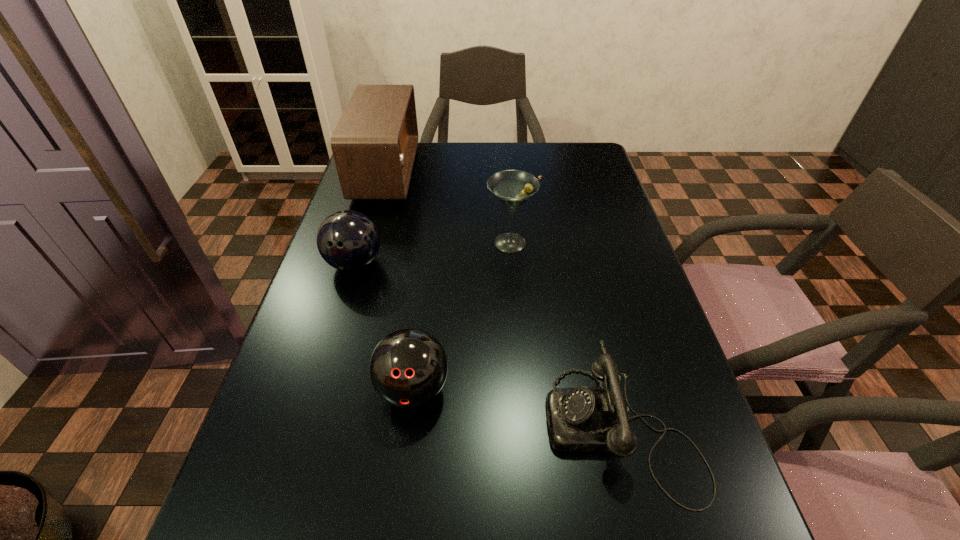
Identify the location of radio receiver. (374, 144).

At what (x,y) coordinates should I click in order to perform the action: click on martini. Please return your answer as a coordinate pair (x, y). Image resolution: width=960 pixels, height=540 pixels. Looking at the image, I should click on (513, 188).

At what (x,y) coordinates should I click in order to perform the action: click on the left bowling ball. Please return your answer as a coordinate pair (x, y). Looking at the image, I should click on (347, 240).

The width and height of the screenshot is (960, 540). Identify the location of the nearer bowling ball. (x=408, y=368).

Identify the location of the third object from right to left. (408, 368).

Image resolution: width=960 pixels, height=540 pixels. Find the location of `the shortest object`. the shortest object is located at coordinates (580, 419).

Where is `vacant region located 0.210m on the front-facing side of the radio receiver`? The image size is (960, 540). vacant region located 0.210m on the front-facing side of the radio receiver is located at coordinates (479, 172).

The width and height of the screenshot is (960, 540). I want to click on vacant space situated 0.320m on the left of the martini, so pos(364,243).

At what (x,y) coordinates should I click in order to perform the action: click on free spot located on the side of the left bowling ball with the finger holes. Please return your answer as a coordinate pair (x, y). The width and height of the screenshot is (960, 540). Looking at the image, I should click on (324, 366).

Locate an element on the screen. This screenshot has width=960, height=540. vacant space located 0.090m on the surface of the third object from left to right near the finger holes is located at coordinates (402, 474).